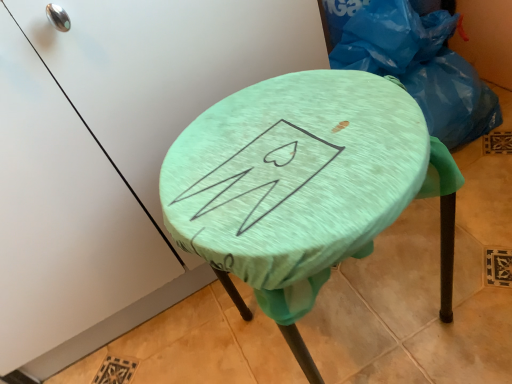
Where is `vacant space underneath mint fabric-covered stool at center (from a real-world perspective)`? The width and height of the screenshot is (512, 384). vacant space underneath mint fabric-covered stool at center (from a real-world perspective) is located at coordinates (357, 322).